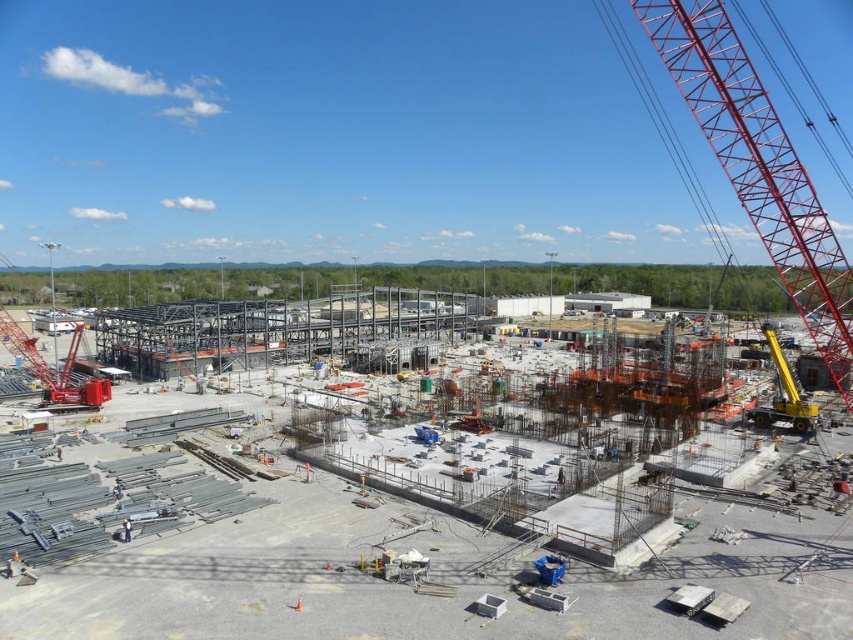
Who is higher up, gray metallic structure at center or metallic red crane at upper right?

metallic red crane at upper right is higher up.

Between gray metallic structure at center and metallic red crane at upper right, which one appears on the right side from the viewer's perspective?

metallic red crane at upper right

Image resolution: width=853 pixels, height=640 pixels. What do you see at coordinates (386, 540) in the screenshot? I see `gray metallic structure at center` at bounding box center [386, 540].

This screenshot has width=853, height=640. Find the location of `gray metallic structure at center`. gray metallic structure at center is located at coordinates point(386,540).

Does gray metallic structure at center have a lesser height compared to metallic red crane at left?

Yes, gray metallic structure at center is shorter than metallic red crane at left.

Who is lower down, gray metallic structure at center or metallic red crane at left?

gray metallic structure at center is below.

Is point (218, 566) farther from camera compared to point (67, 355)?

No, it is not.

The width and height of the screenshot is (853, 640). Find the location of `gray metallic structure at center`. gray metallic structure at center is located at coordinates (386, 540).

Between point (28, 344) and point (769, 426), which one is positioned behind?

Positioned behind is point (28, 344).

Which is more to the right, metallic red crane at left or yellow metallic crane at right?

Positioned to the right is yellow metallic crane at right.

The image size is (853, 640). I want to click on metallic red crane at left, so (54, 369).